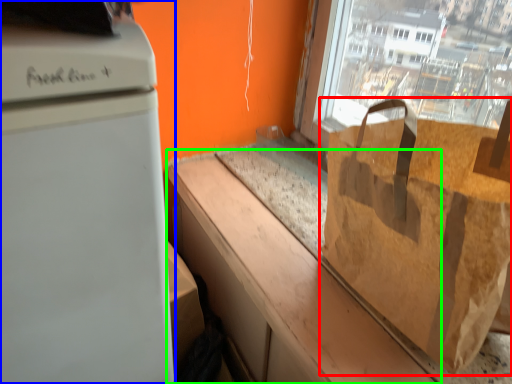
Question: Which is farther away from grocery bag (highlighted by a red box)? home appliance (highlighted by a blue box) or counter top (highlighted by a green box)?

Choices:
 (A) home appliance
 (B) counter top

Answer: (A)